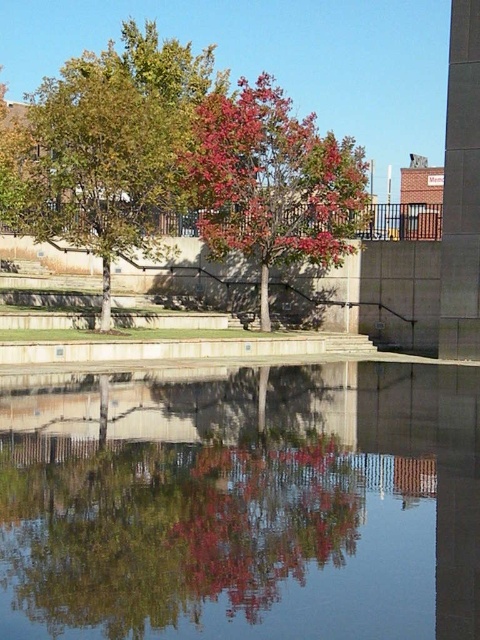
Question: Can you confirm if green leafy tree at center is positioned to the right of shiny red leaves at center?

Choices:
 (A) yes
 (B) no

Answer: (B)

Question: Does smooth reflective water at center come in front of green leafy tree at center?

Choices:
 (A) no
 (B) yes

Answer: (B)

Question: Which of the following is the closest to the observer?

Choices:
 (A) smooth reflective water at center
 (B) green leafy tree at center
 (C) shiny red leaves at center

Answer: (A)

Question: Can you confirm if smooth reflective water at center is positioned to the right of shiny red leaves at center?

Choices:
 (A) no
 (B) yes

Answer: (A)

Question: Which point is farther to the camera?

Choices:
 (A) (222, 524)
 (B) (73, 173)

Answer: (B)

Question: Which of these objects is positioned farthest from the shiny red leaves at center?

Choices:
 (A) smooth reflective water at center
 (B) green leafy tree at center

Answer: (A)